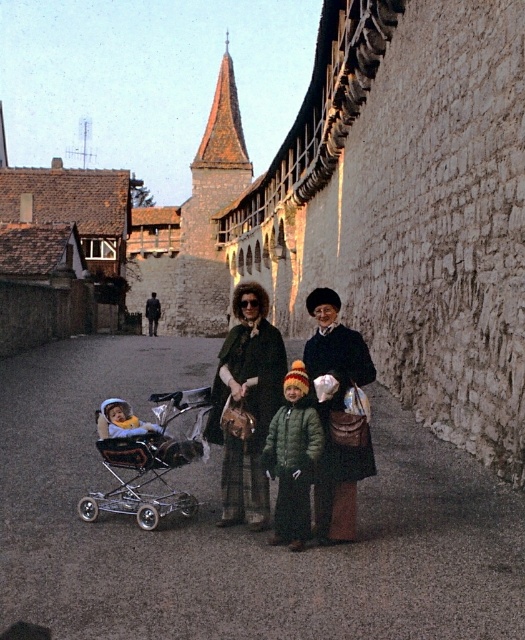
You are a photographer trying to capture a photo of the green woolen coat at center and the soft yellow fabric baby carriage at lower left. Which object should you focus on first if you want to ensure both are in focus without adjusting the camera settings?

The green woolen coat at center is located above the soft yellow fabric baby carriage at lower left. Since the coat is higher up, you should focus on the green woolen coat at center first to ensure both are in focus.

You are a delivery person trying to place a package on the dark gray asphalt at center and the green wool coat at center. Which surface can you place the package on without it sliding off?

The dark gray asphalt at center is shorter than the green wool coat at center, so placing the package on the green wool coat at center would be more stable as it has a larger surface area to prevent sliding.